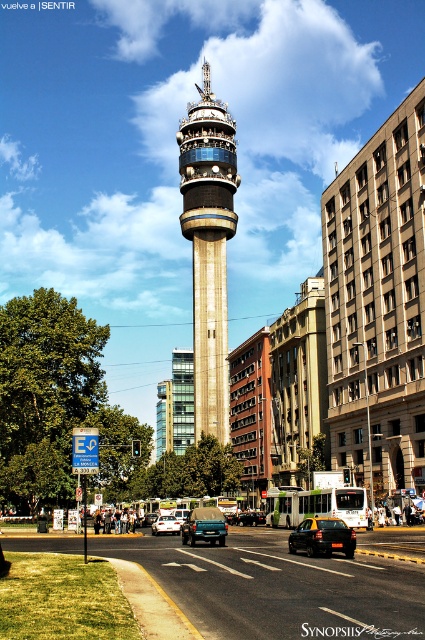
You are standing at the base of the tall tower and want to park your metallic silver sedan at center. The parking spot you want is located at coordinates 0.820, 0.391. Is your car already parked in the desired spot?

The metallic silver sedan at center is already parked at the coordinates [166,524], so yes, it is in the desired parking spot.

You are a city planner evaluating the central plaza. The matte glass control tower at center and the black matte car at center are both in the central area. Which object occupies more space in the plaza?

The matte glass control tower at center has a larger size compared to the black matte car at center, so it occupies more space in the plaza.